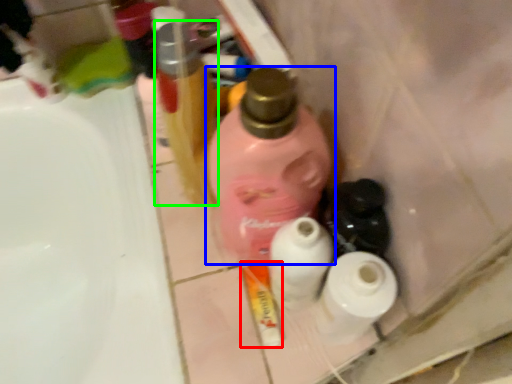
Question: Considering the real-world distances, which object is closest to toothpaste (highlighted by a red box)? bottle (highlighted by a blue box) or bottle (highlighted by a green box).

Choices:
 (A) bottle
 (B) bottle

Answer: (A)